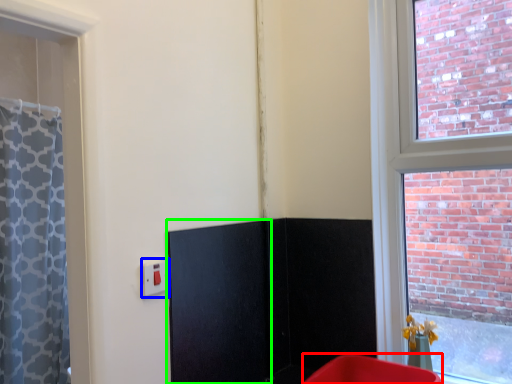
Question: Which is nearer to the furniture (highlighted by a red box)? electric outlet (highlighted by a blue box) or screen door (highlighted by a green box).

Choices:
 (A) electric outlet
 (B) screen door

Answer: (B)